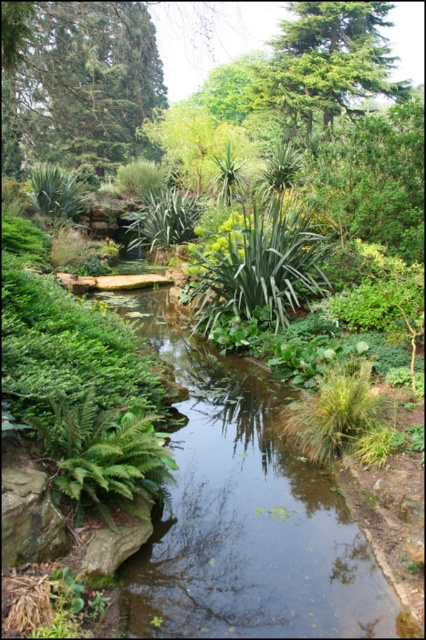
Consider the image. Is green needle-like at upper right smaller than green leafy fern at center?

Incorrect, green needle-like at upper right is not smaller in size than green leafy fern at center.

Is green needle-like at upper right taller than green leafy fern at center?

Yes.

Does point (337, 72) come closer to viewer compared to point (288, 257)?

No, it is not.

What are the coordinates of `green needle-like at upper right` in the screenshot? It's located at (331, 61).

Which is more to the left, green leafy stream at center or green leafy fern at center?

From the viewer's perspective, green leafy stream at center appears more on the left side.

Is green leafy stream at center above green leafy fern at center?

Incorrect, green leafy stream at center is not positioned above green leafy fern at center.

Between point (189, 554) and point (250, 266), which one is positioned in front?

Point (189, 554) is more forward.

Identify the location of green leafy stream at center. tap(244, 513).

Can you confirm if green textured tree at upper left is smaller than green matte fern at lower left?

Actually, green textured tree at upper left might be larger than green matte fern at lower left.

Who is positioned more to the left, green textured tree at upper left or green matte fern at lower left?

Positioned to the left is green textured tree at upper left.

Find the location of a particular element. The width and height of the screenshot is (426, 640). green textured tree at upper left is located at coordinates (77, 83).